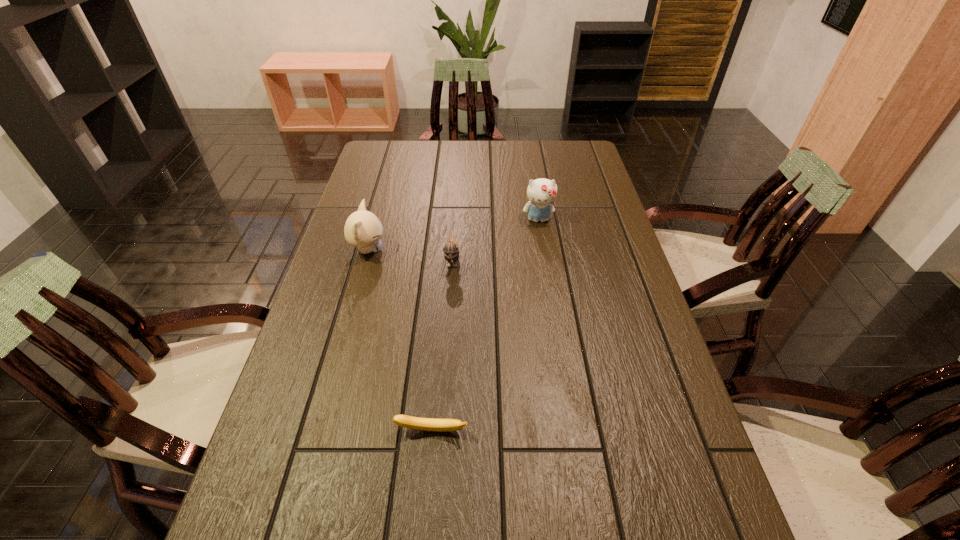
What are the coordinates of `the farthest kitten` in the screenshot? It's located at (541, 193).

Locate an element on the screen. The image size is (960, 540). the rightmost object is located at coordinates (541, 193).

I want to click on the leftmost object, so click(363, 229).

Locate an element on the screen. The height and width of the screenshot is (540, 960). the shortest kitten is located at coordinates [x=450, y=249].

Where is `the third tallest object`? Image resolution: width=960 pixels, height=540 pixels. the third tallest object is located at coordinates (450, 249).

Find the location of `banana`. banana is located at coordinates pyautogui.click(x=426, y=424).

Where is `the nearest object`? the nearest object is located at coordinates (426, 424).

Locate an element on the screen. The height and width of the screenshot is (540, 960). free space located on the front-facing side of the farthest kitten is located at coordinates (555, 322).

Find the location of a particular element. This screenshot has width=960, height=540. free space located on the face of the leftmost kitten is located at coordinates (416, 250).

What are the coordinates of `free space located on the front-facing side of the third tallest object` in the screenshot? It's located at (447, 329).